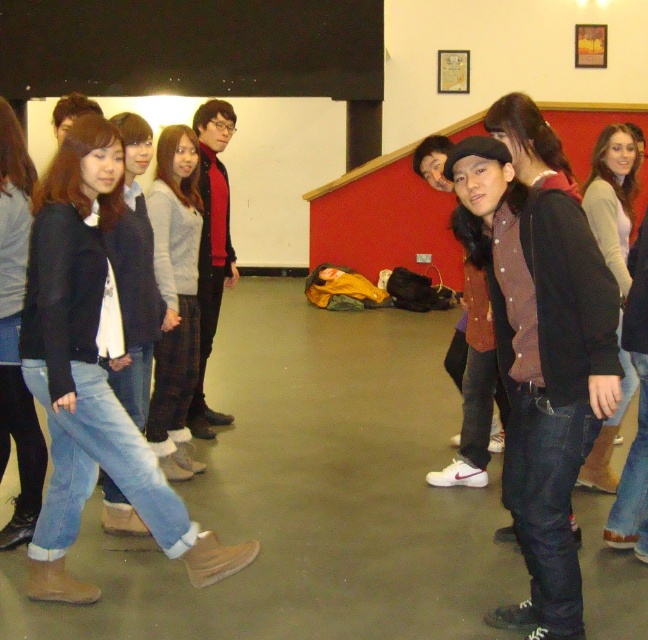
Who is positioned more to the right, denim jeans at left or dark red sweater at center?

dark red sweater at center is more to the right.

Is denim jeans at left above dark red sweater at center?

No.

You are a GUI agent. You are given a task and a screenshot of the screen. Output one action in this format:
    pyautogui.click(x=<x>, y=<y>)
    Task: Click on the denim jeans at left
    
    Given the screenshot: What is the action you would take?
    pyautogui.click(x=91, y=372)

Who is taller, denim jacket at center or denim jeans at left?

A: denim jeans at left is taller.

Who is more distant from viewer, (509, 266) or (76, 301)?

Point (76, 301)

Find the location of a particular element. The height and width of the screenshot is (640, 648). denim jacket at center is located at coordinates (540, 362).

Between point (148, 417) and point (621, 381), which one is positioned in front?

Point (621, 381) is more forward.

Which is in front, point (168, 156) or point (608, 445)?

Point (168, 156) is more forward.

Find the location of a particular element. This screenshot has height=640, width=648. flannel plaid pants at center is located at coordinates (176, 298).